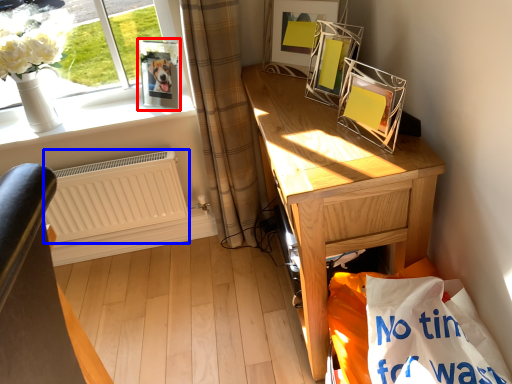
Question: Which point is further to the camera, picture frame (highlighted by a red box) or radiator (highlighted by a blue box)?

Choices:
 (A) picture frame
 (B) radiator

Answer: (B)